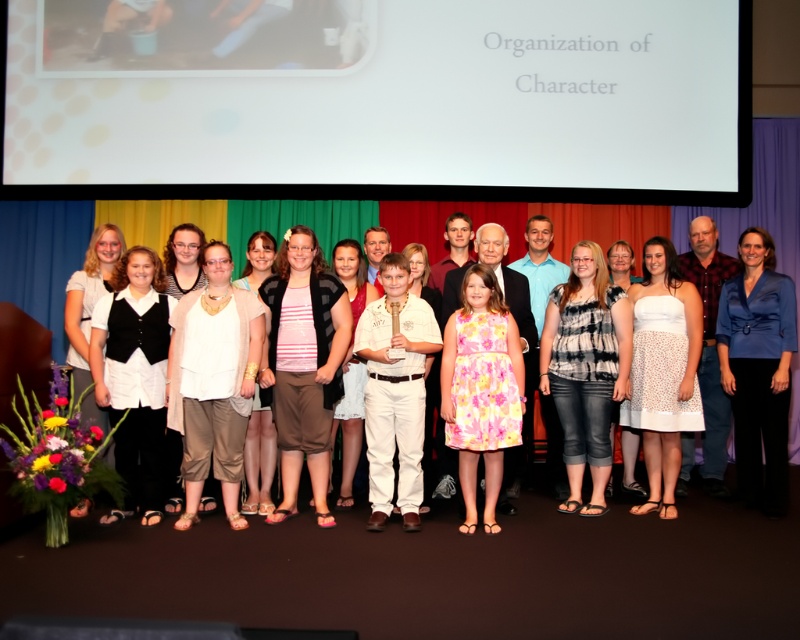
Question: Can you confirm if blue satin blazer at center is positioned to the left of blue plaid shirt at right?

Choices:
 (A) yes
 (B) no

Answer: (B)

Question: Does blue satin blazer at center have a larger size compared to white matte dress at left?

Choices:
 (A) yes
 (B) no

Answer: (B)

Question: Among these points, which one is farthest from the camera?

Choices:
 (A) (208, 300)
 (B) (64, 316)

Answer: (B)

Question: Which object is farther from the camera taking this photo?

Choices:
 (A) white textured dress at left
 (B) striped cotton shirt at center
 (C) white textured blouse at center
 (D) white matte dress at left

Answer: (A)

Question: Which object is positioned closest to the white textured dress at left?

Choices:
 (A) white textured blouse at center
 (B) striped cotton shirt at center

Answer: (B)

Question: Can you confirm if striped cotton shirt at center is positioned below white matte dress at left?

Choices:
 (A) no
 (B) yes

Answer: (B)